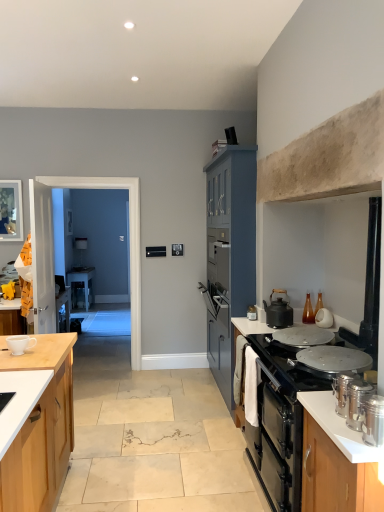
Question: Is matte black desk at center taller or shorter than transparent glass door at left, the 2th glass door in the back-to-front sequence?

Choices:
 (A) tall
 (B) short

Answer: (B)

Question: From a real-world perspective, is matte black desk at center physically located above or below transparent glass door at left, placed as the first glass door when sorted from front to back?

Choices:
 (A) below
 (B) above

Answer: (A)

Question: Estimate the real-world distances between objects in this image. Which object is farther from the satin silver canisters at right, placed as the 3th kitchen appliance when sorted from back to front?

Choices:
 (A) satin silver canisters at right, the 4th kitchen appliance viewed from the back
 (B) matte black kettle at right, placed as the 1th kitchen appliance when sorted from back to front
 (C) silver metallic canisters at lower right, the first cabinetry positioned from the front
 (D) white ceramic cup at left
 (E) matte black pot/pan at center

Answer: (D)

Question: Which is nearer to the transparent glass door at left, the 2th glass door in the back-to-front sequence?

Choices:
 (A) white ceramic cup at left
 (B) silver metallic canisters at right, acting as the second countertop starting from the bottom
 (C) satin silver canisters at right, the 2th kitchen appliance when ordered from front to back
 (D) white glossy coffee maker at upper center
 (E) matte blue cabinet at center, the 1th cabinetry when ordered from back to front

Answer: (A)